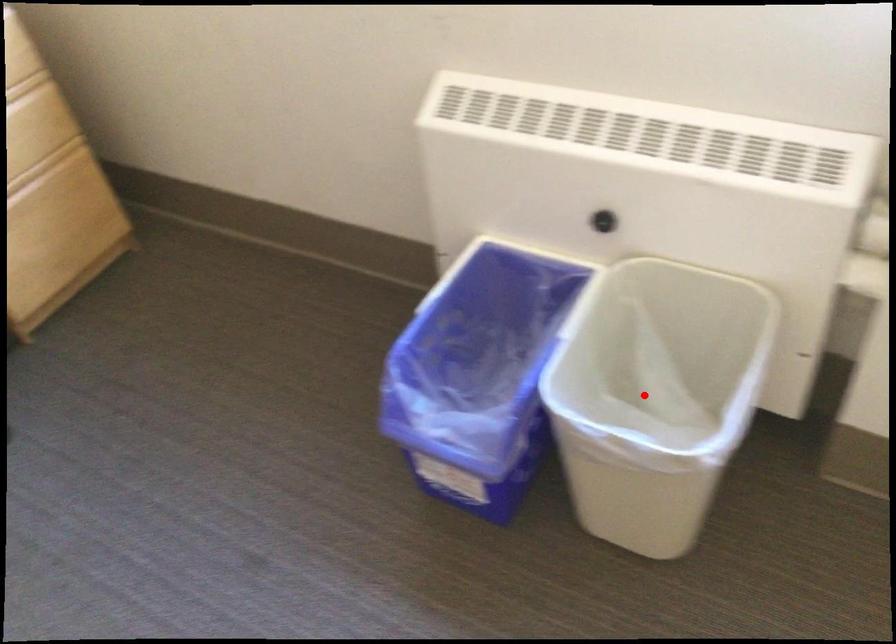
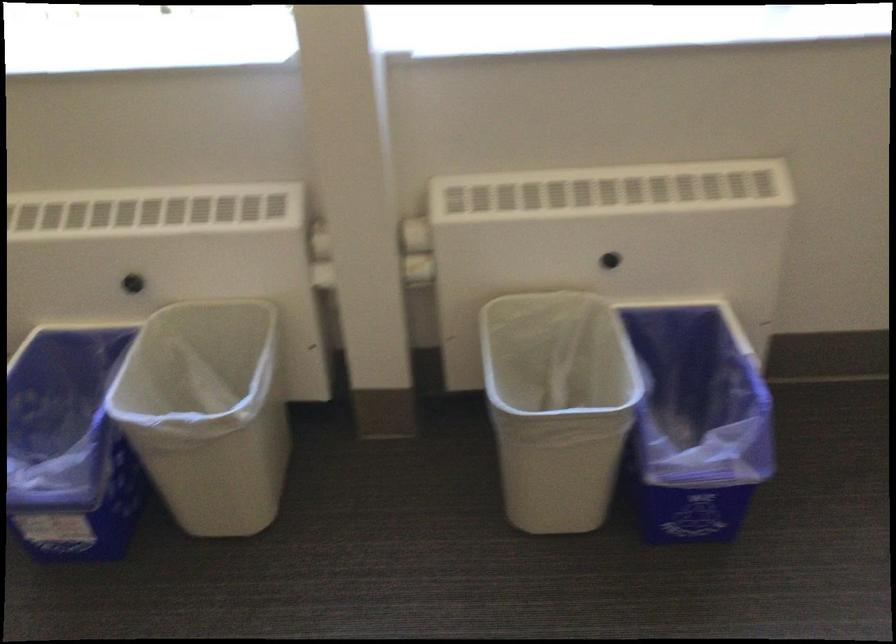
Question: I am providing you with two images of the same scene from different viewpoints. Given a red point in image1, look at the same physical point in image2. Is it:

Choices:
 (A) Closer to the viewpoint
 (B) Farther from the viewpoint

Answer: (B)